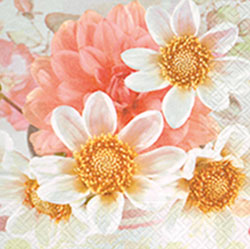
You are a GUI agent. You are given a task and a screenshot of the screen. Output one action in this format:
    pyautogui.click(x=<x>, y=<y>)
    Task: Click on the stems on tablecloth
    This screenshot has width=250, height=249.
    Given the screenshot: What is the action you would take?
    pyautogui.click(x=37, y=33), pyautogui.click(x=48, y=46)